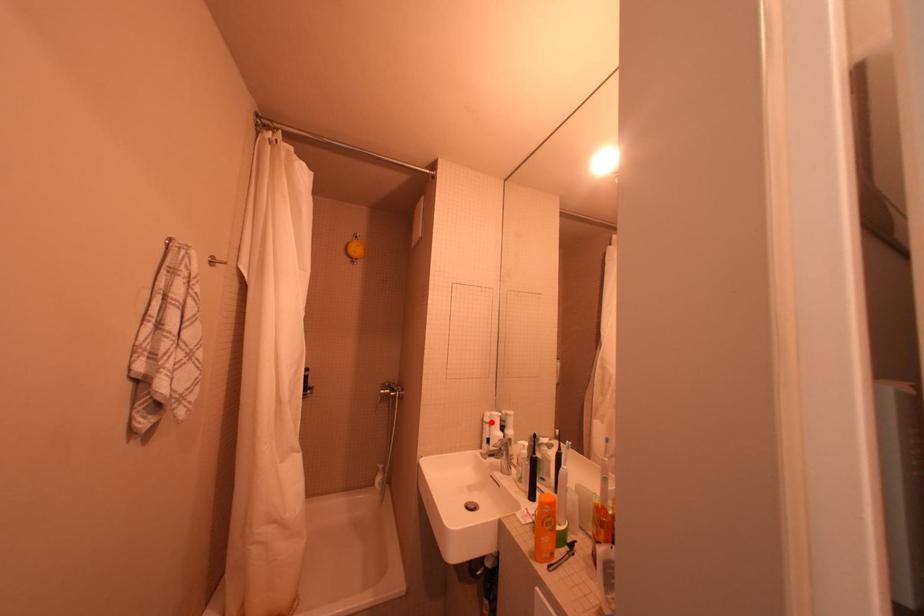
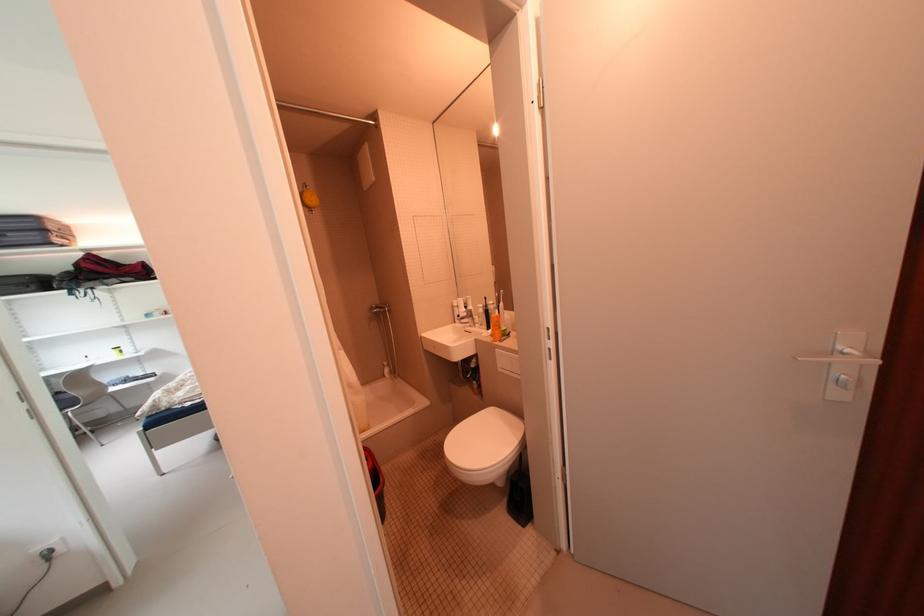
Question: I am providing you with two images of the same scene from different viewpoints. Image1 has a red point marked. In image2, the corresponding 3D location appears at what relative position? Reply with the corresponding letter.

Choices:
 (A) Closer
 (B) Farther

Answer: (A)